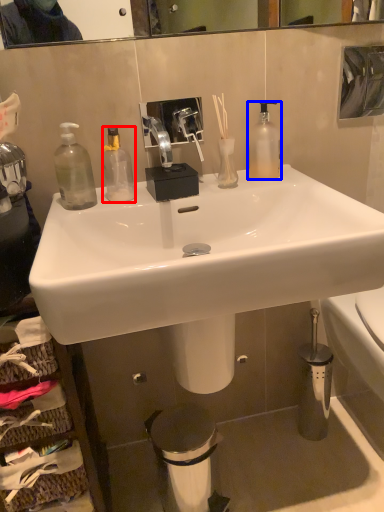
Question: Which point is further to the camera, bottle (highlighted by a red box) or bottle (highlighted by a blue box)?

Choices:
 (A) bottle
 (B) bottle

Answer: (B)